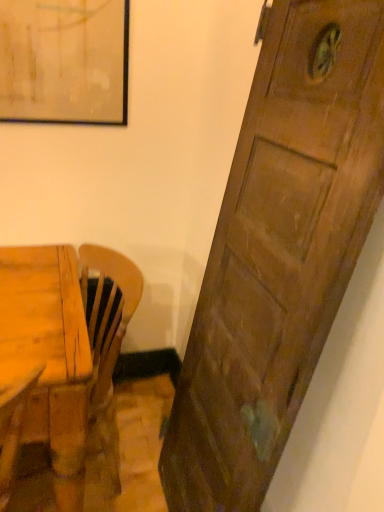
Question: Should I look upward or downward to see wooden chair at lower left?

Choices:
 (A) up
 (B) down

Answer: (B)